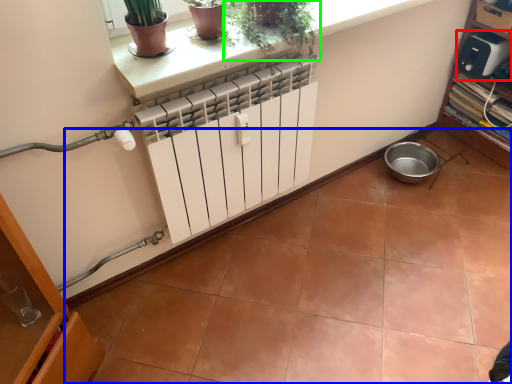
Question: Which is nearer to the appliance (highlighted by a red box)? ceramic tile (highlighted by a blue box) or houseplant (highlighted by a green box).

Choices:
 (A) ceramic tile
 (B) houseplant

Answer: (A)